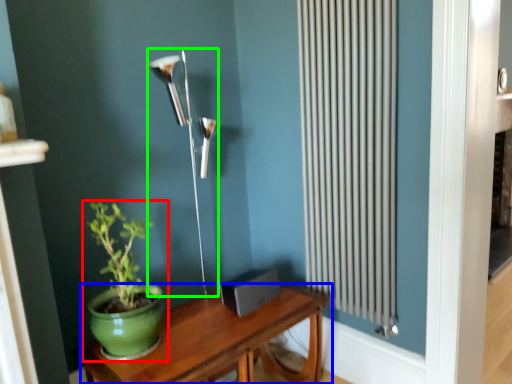
Question: Which object is the closest to the houseplant (highlighted by a red box)? Choose among these: table (highlighted by a blue box) or lamp (highlighted by a green box).

Choices:
 (A) table
 (B) lamp

Answer: (A)